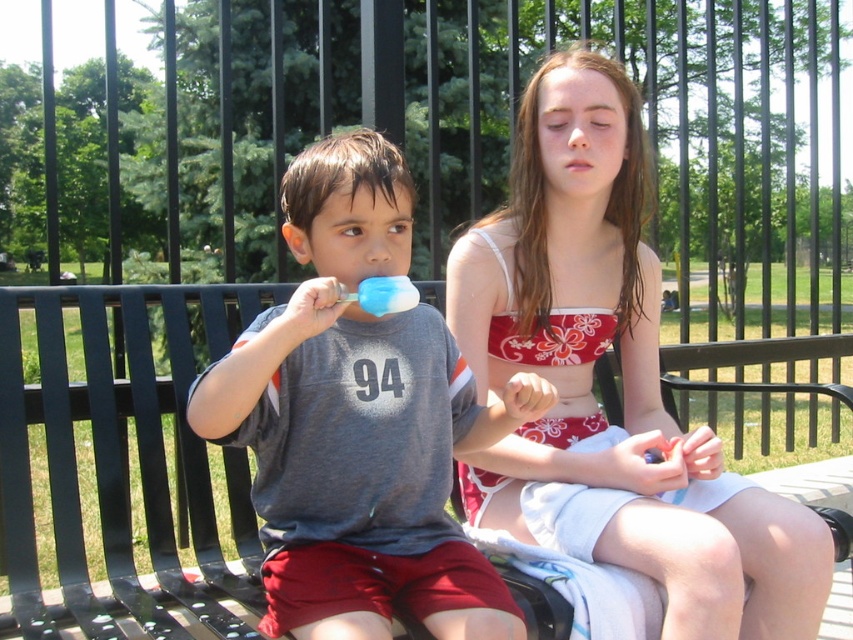
You are a photographer standing in front of the children to take a photo. You want to ensure that the red floral tank top at center is in focus. What should you consider about its distance?

The red floral tank top at center is 1.20 meters from the viewer, so you should adjust the camera focus to that distance to ensure it is sharp in the photo.

You are a photographer trying to capture the girl in the red floral tank top at center. Where should you position your camera to ensure she is centered in the frame?

Position the camera at point (621, 378) to center the red floral tank top at center in the frame.